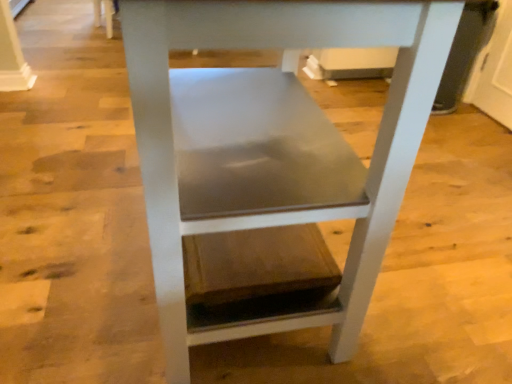
Looking at this image, in order to face matte gray table at center, should I rotate leftwards or rightwards?

To face it directly, rotate left by 1.938 degrees.

Measure the distance between matte gray table at center and camera.

The distance of matte gray table at center from camera is 20.13 inches.

This screenshot has height=384, width=512. What are the coordinates of `matte gray table at center` in the screenshot? It's located at (271, 149).

Describe the element at coordinates (271, 149) in the screenshot. I see `matte gray table at center` at that location.

Locate an element on the screen. The image size is (512, 384). matte gray table at center is located at coordinates (271, 149).